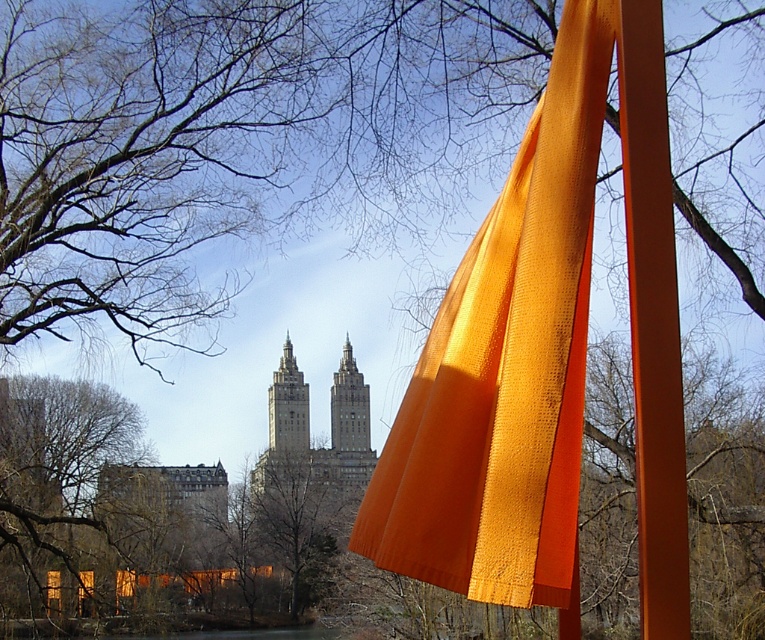
You are a park visitor standing at the entrance and want to locate the orange fabric at center. According to the coordinates provided, where should you look relative to the two historic buildings in the background?

The orange fabric at center is located at coordinates point (x=505, y=365), which places it closer to the right side of the image and slightly above the center, so you should look towards the right side between the two historic buildings in the background.

You are a park visitor carrying a 10 meter long pole. You want to place it horizontally between the orange fabric at center and the orange matte pole at right. Is there enough space to do so without bending the pole?

The orange fabric at center and orange matte pole at right are 10.72 meters apart from each other. Since the pole is 10 meters long, there is enough space to place it horizontally between them without bending it.

Based on the scene description, where is the matte gray stone tower at center located in the image?

The matte gray stone tower at center is located at point (x=285, y=428) in the image.